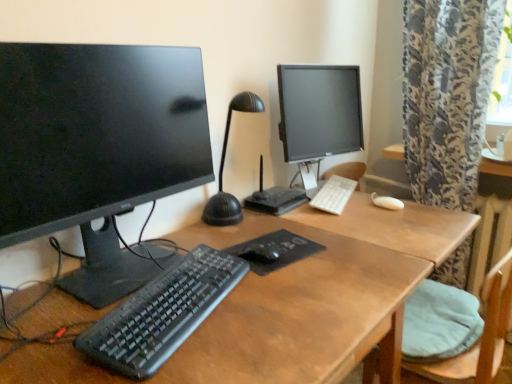
The width and height of the screenshot is (512, 384). What are the coordinates of `spots to the right of black matte mouse at center` in the screenshot? It's located at (330, 256).